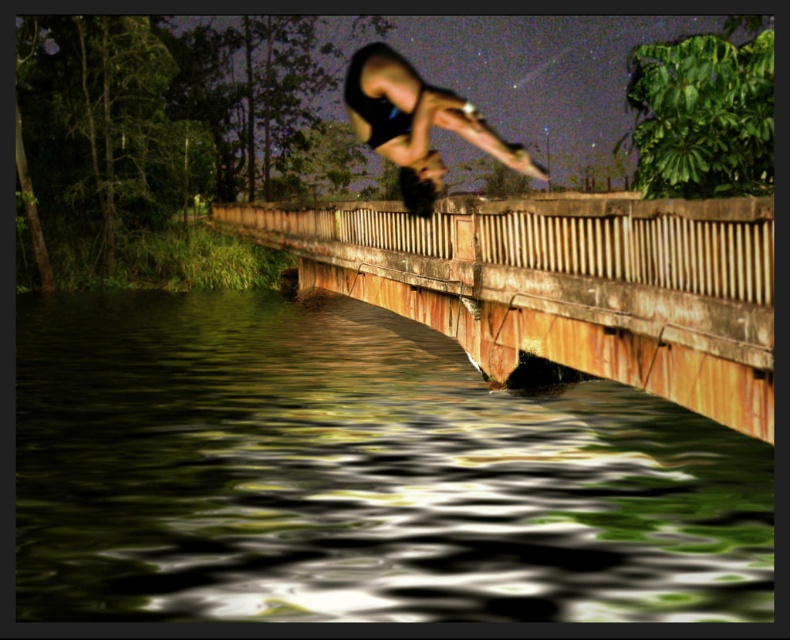
You are standing on the bridge and want to jump into the water. You notice two points in the scene labeled as point (514, 264) and point (414, 211). Which point is closer to you as you stand on the bridge?

Point (514, 264) is further to the viewer than point (414, 211). Therefore, point (414, 211) is closer to you as you stand on the bridge.

You are standing at the point labeled point (606, 426) and want to take a photo of the bridge and the person performing a backflip. Since the camera is 39.95 feet away from your position, will you be able to capture the entire scene in one shot?

The camera is 39.95 feet away from the point labeled point (606, 426), so you will be able to capture the entire scene in one shot since the distance is sufficient to include both the bridge and the person mid backflip.